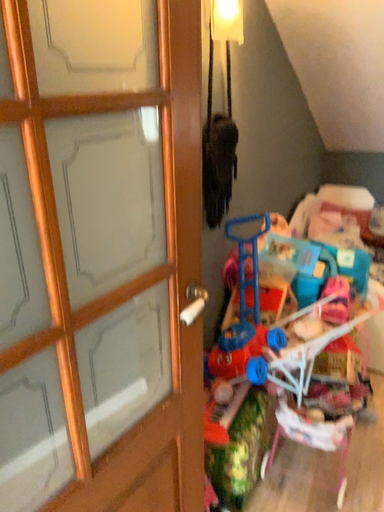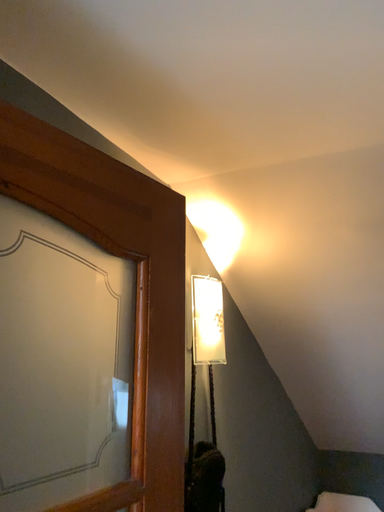
Question: How did the camera likely rotate when shooting the video?

Choices:
 (A) rotated upward
 (B) rotated downward

Answer: (A)